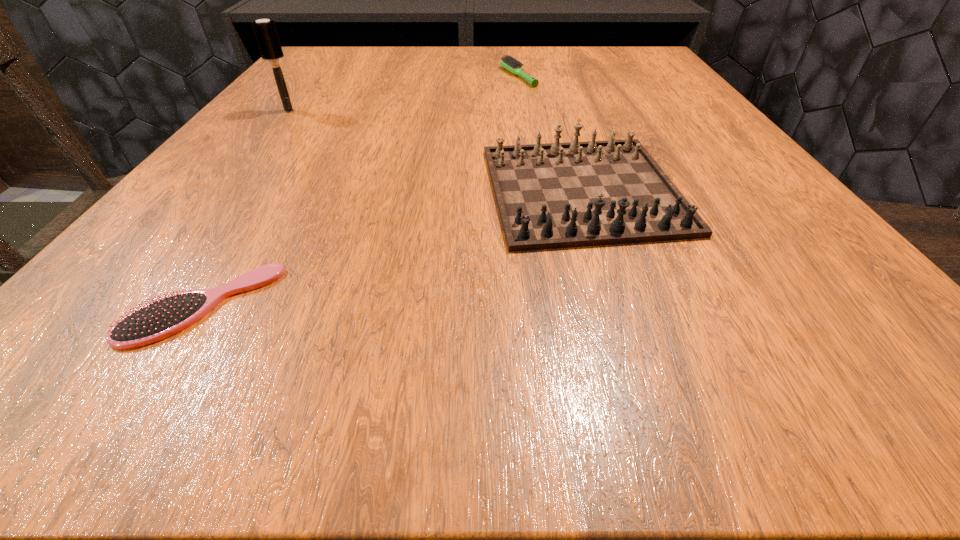
This screenshot has height=540, width=960. I want to click on vacant space positioned on the front of the farthest hairbrush, so click(524, 112).

The width and height of the screenshot is (960, 540). I want to click on vacant space situated on the back of the nearest hairbrush, so click(311, 133).

Image resolution: width=960 pixels, height=540 pixels. What are the coordinates of `object that is at the far edge` in the screenshot? It's located at (509, 63).

Identify the location of object at the near edge. (160, 319).

Identify the location of object positioned at the right edge. The height and width of the screenshot is (540, 960). (558, 195).

This screenshot has height=540, width=960. Find the location of `object located in the near left corner section of the desktop`. object located in the near left corner section of the desktop is located at coordinates (160, 319).

Find the location of `vacant space at the far edge`. vacant space at the far edge is located at coordinates (526, 58).

I want to click on free space at the near edge of the desktop, so (225, 332).

Locate an element on the screen. The width and height of the screenshot is (960, 540). free space at the left edge of the desktop is located at coordinates (242, 126).

Locate an element on the screen. This screenshot has width=960, height=540. vacant space at the far left corner is located at coordinates (325, 54).